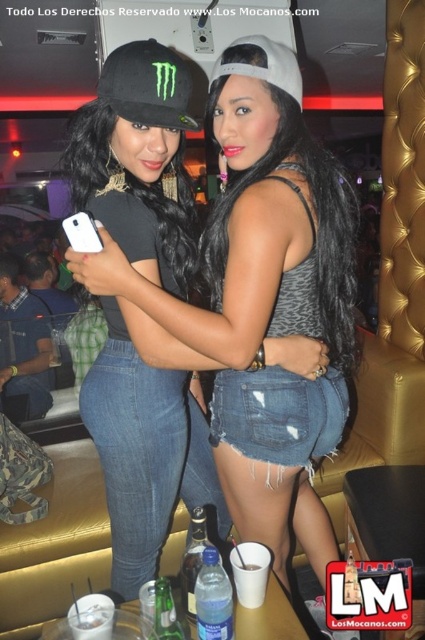
Who is lower down, black matte baseball cap at upper left or clear plastic bottle at lower center?

clear plastic bottle at lower center is below.

Between black matte baseball cap at upper left and clear plastic bottle at lower center, which one is positioned higher?

Positioned higher is black matte baseball cap at upper left.

Find the location of a particular element. The width and height of the screenshot is (425, 640). black matte baseball cap at upper left is located at coordinates (147, 84).

Between black matte cap at upper left and clear plastic bottle at center, which one has more height?

Standing taller between the two is black matte cap at upper left.

Does black matte cap at upper left appear on the left side of clear plastic bottle at center?

Incorrect, black matte cap at upper left is not on the left side of clear plastic bottle at center.

The height and width of the screenshot is (640, 425). Describe the element at coordinates (263, 300) in the screenshot. I see `black matte cap at upper left` at that location.

Locate an element on the screen. The height and width of the screenshot is (640, 425). black matte cap at upper left is located at coordinates (263, 300).

Is clear plastic bottle at center below white matte smartphone at upper left?

Correct, clear plastic bottle at center is located below white matte smartphone at upper left.

Who is more forward, (195, 547) or (90, 248)?

Positioned in front is point (90, 248).

I want to click on clear plastic bottle at center, so click(192, 560).